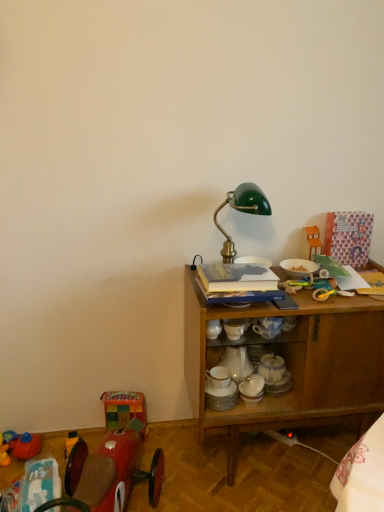
Question: In terms of width, does green glass table lamp at center look wider or thinner when compared to wooden cabinet at right?

Choices:
 (A) thin
 (B) wide

Answer: (A)

Question: In terms of size, does green glass table lamp at center appear bigger or smaller than wooden cabinet at right?

Choices:
 (A) small
 (B) big

Answer: (A)

Question: Which object is the farthest from the rubber duck at lower left, arranged as the 4th toy when viewed from the right?

Choices:
 (A) orange plastic toy house at upper right, positioned as the 4th toy in bottom-to-top order
 (B) shiny red car at lower left, which is counted as the 3th toy, starting from the top
 (C) green glass table lamp at center
 (D) hardcover book at center
 (E) wooden cabinet at right

Answer: (A)

Question: Which object is the closest to the orange plastic toy house at upper right, the 1th toy positioned from the top?

Choices:
 (A) green glass table lamp at center
 (B) shiny red car at lower left, which is counted as the 3th toy, starting from the top
 (C) multicolored fabric cube at lower left, the second toy when ordered from top to bottom
 (D) wooden cabinet at right
 (E) rubber duck at lower left, arranged as the 4th toy when viewed from the right

Answer: (A)